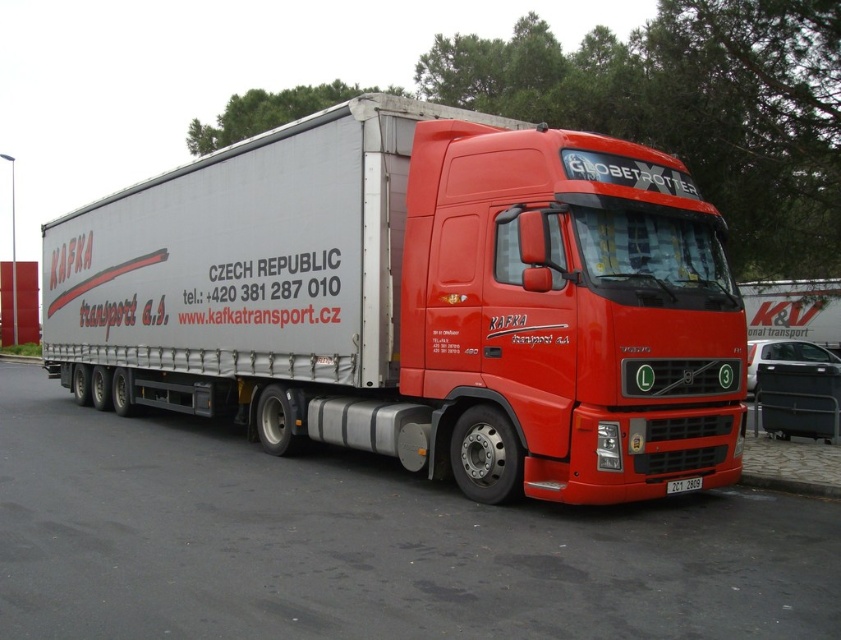
Question: Does metallic silver trailer at center have a larger size compared to matte white trailer at center?

Choices:
 (A) no
 (B) yes

Answer: (B)

Question: Can you confirm if metallic silver trailer at center is bigger than black plastic license plate at bottom center?

Choices:
 (A) yes
 (B) no

Answer: (A)

Question: Which object is farther from the camera taking this photo?

Choices:
 (A) black plastic license plate at bottom center
 (B) metallic silver trailer at center

Answer: (A)

Question: Does matte white trailer at center come behind black plastic license plate at bottom center?

Choices:
 (A) no
 (B) yes

Answer: (A)

Question: Among these objects, which one is nearest to the camera?

Choices:
 (A) black plastic license plate at bottom center
 (B) matte white trailer at center
 (C) metallic silver trailer at center

Answer: (B)

Question: Estimate the real-world distances between objects in this image. Which object is farther from the metallic silver trailer at center?

Choices:
 (A) matte white trailer at center
 (B) black plastic license plate at bottom center

Answer: (B)